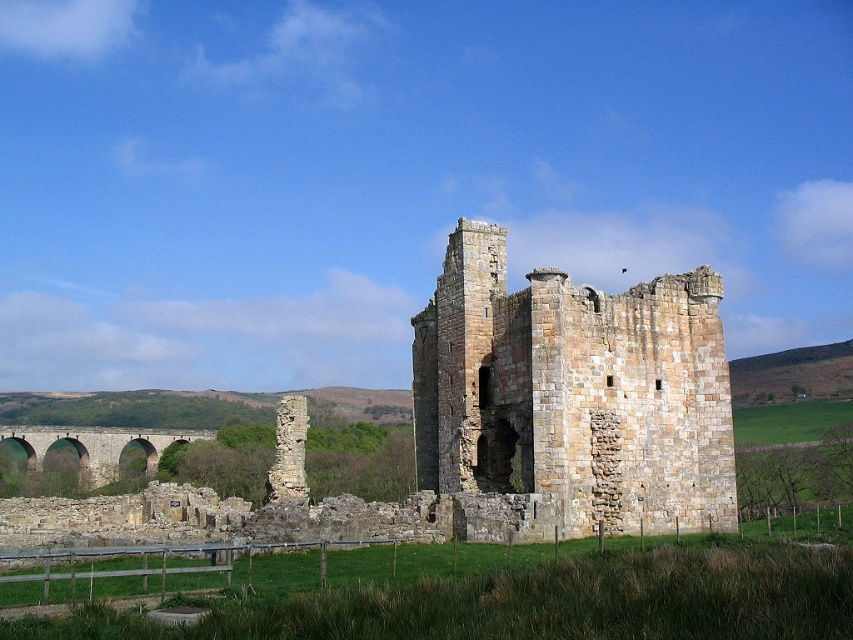
You are an architect analyzing the image of the historic site. You need to determine which structure occupies more space in the image. Based on the stone ruins at center and the brown stone viaduct at lower left, which one is larger in size?

The stone ruins at center has a smaller size compared to brown stone viaduct at lower left, so the brown stone viaduct at lower left is larger in size.

You are a hiker who wants to take a photo of the stone ruins at center and the brown stone viaduct at lower left. Which object should you stand closer to in order to capture both in a single frame without zooming?

You should stand closer to the brown stone viaduct at lower left because the stone ruins at center are taller, so reducing the distance to the shorter object helps balance their apparent sizes in the photo.